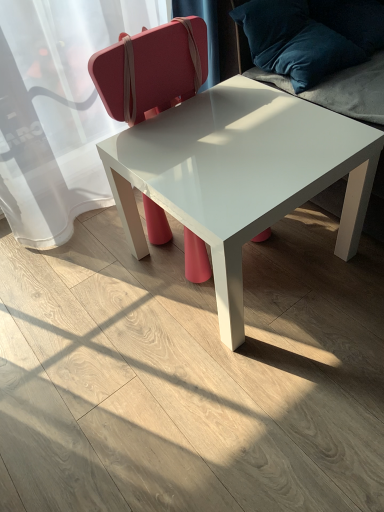
Question: Does matte pink suitcase at center touch velvet blue pillow at upper right?

Choices:
 (A) yes
 (B) no

Answer: (B)

Question: From a real-world perspective, is matte pink suitcase at center physically above velvet blue pillow at upper right?

Choices:
 (A) yes
 (B) no

Answer: (B)

Question: Is matte pink suitcase at center facing towards velvet blue pillow at upper right?

Choices:
 (A) no
 (B) yes

Answer: (A)

Question: Can you confirm if matte pink suitcase at center is thinner than velvet blue pillow at upper right?

Choices:
 (A) no
 (B) yes

Answer: (B)

Question: Is matte pink suitcase at center bigger than velvet blue pillow at upper right?

Choices:
 (A) yes
 (B) no

Answer: (A)

Question: Is point (221, 99) closer or farther from the camera than point (203, 58)?

Choices:
 (A) farther
 (B) closer

Answer: (B)

Question: In the image, is white glossy table at center positioned in front of or behind matte pink suitcase at center?

Choices:
 (A) behind
 (B) front

Answer: (B)

Question: From the image's perspective, is white glossy table at center located above or below matte pink suitcase at center?

Choices:
 (A) above
 (B) below

Answer: (B)

Question: Is white glossy table at center spatially inside matte pink suitcase at center, or outside of it?

Choices:
 (A) outside
 (B) inside

Answer: (B)

Question: Do you think velvet blue pillow at upper right is within matte pink suitcase at center, or outside of it?

Choices:
 (A) outside
 (B) inside

Answer: (A)

Question: Considering the relative positions of velvet blue pillow at upper right and matte pink suitcase at center in the image provided, is velvet blue pillow at upper right to the left or to the right of matte pink suitcase at center?

Choices:
 (A) left
 (B) right

Answer: (B)

Question: From the image's perspective, is velvet blue pillow at upper right above or below matte pink suitcase at center?

Choices:
 (A) above
 (B) below

Answer: (A)

Question: Is point (372, 84) closer or farther from the camera than point (175, 96)?

Choices:
 (A) farther
 (B) closer

Answer: (B)

Question: Considering the positions of matte pink suitcase at center and velvet blue pillow at upper right in the image, is matte pink suitcase at center bigger or smaller than velvet blue pillow at upper right?

Choices:
 (A) big
 (B) small

Answer: (A)

Question: From the image's perspective, relative to velvet blue pillow at upper right, is matte pink suitcase at center above or below?

Choices:
 (A) above
 (B) below

Answer: (B)